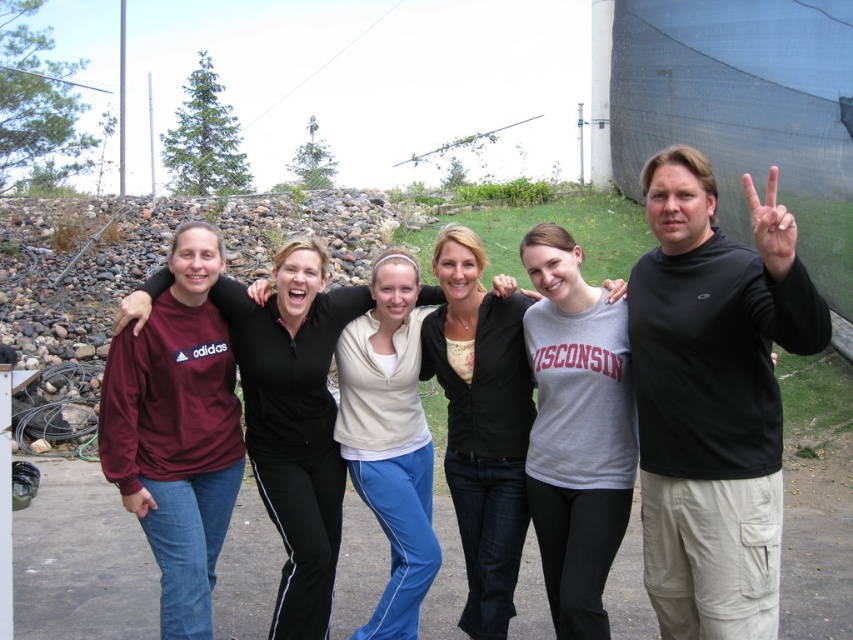
Question: Does black turtleneck shirt at center appear under maroon fleece at left?

Choices:
 (A) yes
 (B) no

Answer: (B)

Question: Which object is the closest to the gray cotton hoodie at center?

Choices:
 (A) maroon fleece at left
 (B) black matte hand at upper right
 (C) black turtleneck shirt at center

Answer: (A)

Question: Which object is positioned farthest from the black matte hand at upper right?

Choices:
 (A) gray cotton hoodie at center
 (B) black turtleneck shirt at center
 (C) maroon fleece at left

Answer: (C)

Question: Does maroon fleece at left have a smaller size compared to gray cotton hoodie at center?

Choices:
 (A) yes
 (B) no

Answer: (B)

Question: Which object is positioned farthest from the maroon fleece at left?

Choices:
 (A) black turtleneck shirt at center
 (B) black matte hand at upper right
 (C) gray cotton hoodie at center

Answer: (B)

Question: Is black turtleneck shirt at center to the left of maroon fleece at left from the viewer's perspective?

Choices:
 (A) no
 (B) yes

Answer: (A)